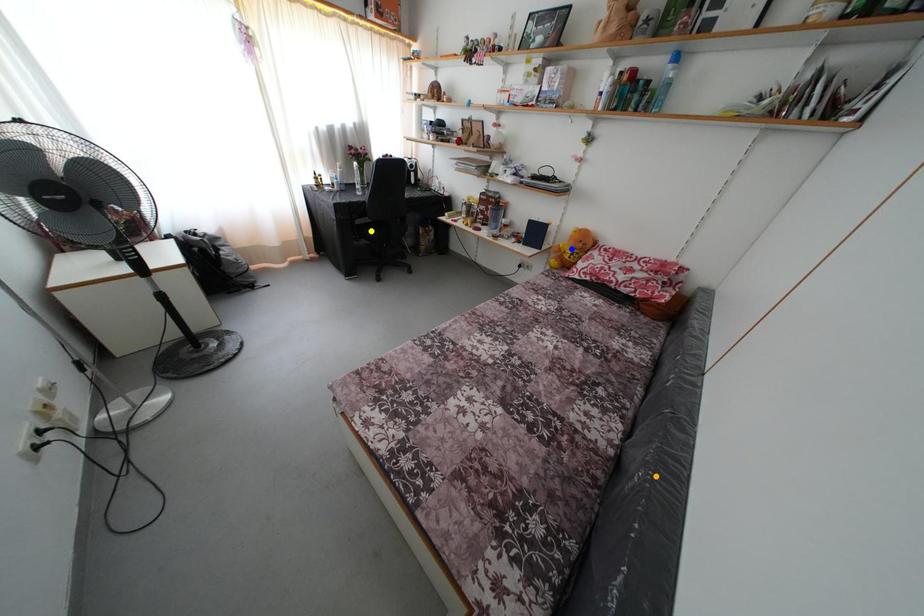
Order these from nearest to farthest:
yellow point
blue point
orange point

orange point, blue point, yellow point